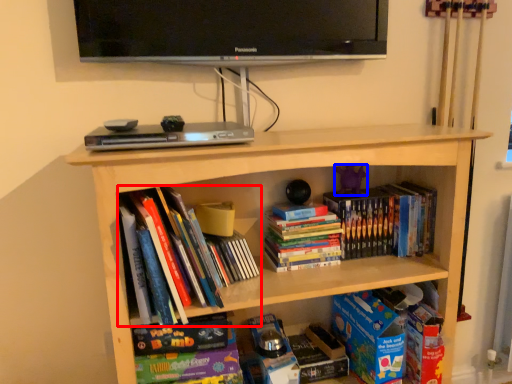
Question: Among these objects, which one is nearest to the camera, book (highlighted by a red box) or toy (highlighted by a blue box)?

Choices:
 (A) book
 (B) toy

Answer: (A)